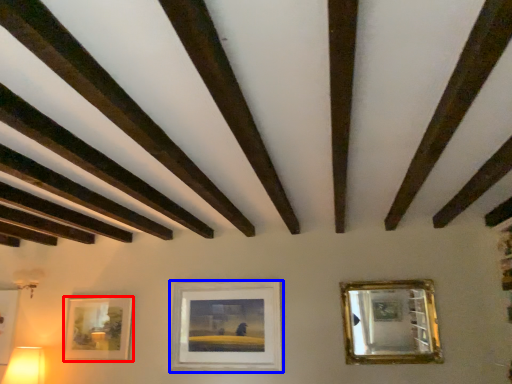
Question: Among these objects, which one is nearest to the camera, picture frame (highlighted by a red box) or picture frame (highlighted by a blue box)?

Choices:
 (A) picture frame
 (B) picture frame

Answer: (B)